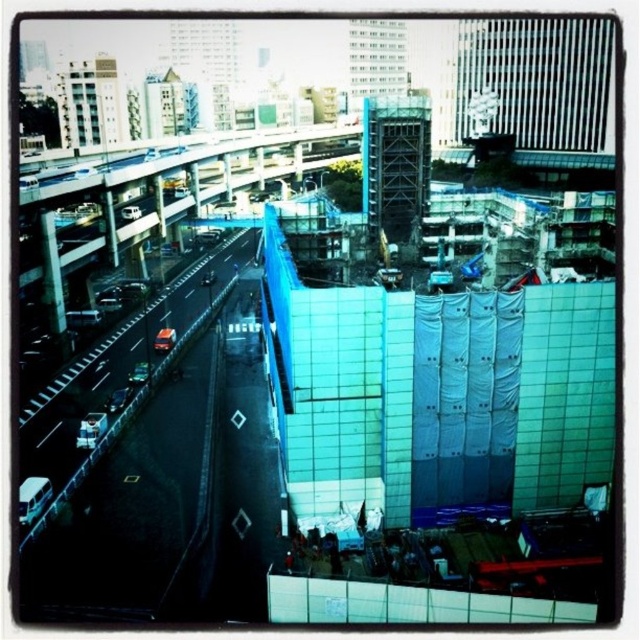
You are a city planner analyzing traffic flow. You observe the black asphalt highway at left and the blue glass overpass at center. Which of these two structures has a narrower width?

The black asphalt highway at left is thinner than the blue glass overpass at center, so the black asphalt highway at left has a narrower width.

You are a drone operator trying to capture a photo of the construction site. You need to ensure the black asphalt highway at left is not in the frame. Based on its 2D coordinates, can you position the camera to exclude the highway?

The black asphalt highway at left is located at coordinates (156, 461). By adjusting the camera angle or zoom, you can frame the shot to exclude the area where the highway is positioned at those coordinates.

Consider the image. You are a drone operator who needs to fly a drone from the black asphalt highway at left to the blue glass overpass at center. Considering their heights, will the drone have to ascend or descend to reach its destination?

The black asphalt highway at left has a lesser height compared to the blue glass overpass at center, so the drone will have to ascend to reach the blue glass overpass at center.